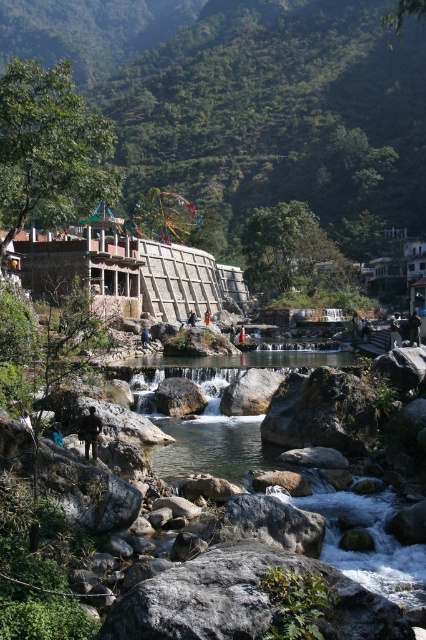
Looking at this image, you are standing at the edge of the river and see the clear water stream at center and the dark gray fabric person at center. Which object is closer to your right side?

The clear water stream at center is to the right of dark gray fabric person at center, so the clear water stream at center is closer to your right side.

You are standing at the edge of the river and want to place a small decorative stone at each of the two points marked in the image. The first point is at coordinates point (94,406) and the second at point (147,339). Which point is closer to you so that you can place the stone without moving further into the river?

Point (94,406) is closer to the viewer than point (147,339), so you can place the stone there without moving further into the river.